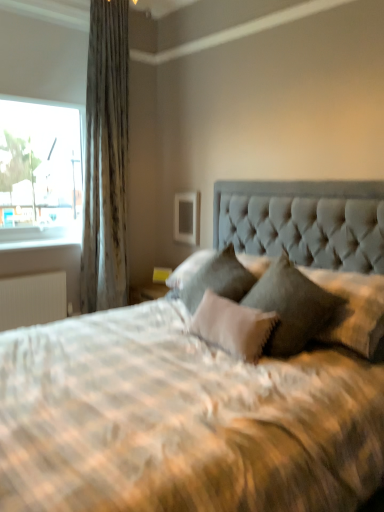
Question: Which direction should I rotate to face velvet gray pillow at center, the 3th pillow in the right-to-left sequence, — up or down?

Choices:
 (A) down
 (B) up

Answer: (A)

Question: Can you confirm if satin fabric curtain at left is bigger than velvet gray pillow at center, placed as the 1th pillow when sorted from right to left?

Choices:
 (A) yes
 (B) no

Answer: (A)

Question: From the image's perspective, is satin fabric curtain at left located above velvet gray pillow at center, which ranks as the third pillow in left-to-right order?

Choices:
 (A) no
 (B) yes

Answer: (B)

Question: Is satin fabric curtain at left wider than velvet gray pillow at center, which ranks as the third pillow in left-to-right order?

Choices:
 (A) yes
 (B) no

Answer: (B)

Question: Does satin fabric curtain at left contain velvet gray pillow at center, which ranks as the third pillow in left-to-right order?

Choices:
 (A) no
 (B) yes

Answer: (A)

Question: Could you tell me if satin fabric curtain at left is turned towards velvet gray pillow at center, placed as the 1th pillow when sorted from right to left?

Choices:
 (A) no
 (B) yes

Answer: (B)

Question: From the image's perspective, is satin fabric curtain at left below velvet gray pillow at center, placed as the 1th pillow when sorted from right to left?

Choices:
 (A) yes
 (B) no

Answer: (B)

Question: Considering the relative sizes of velvet gray pillow at center, the 1th pillow from the left, and white textured pillow at center, the second pillow positioned from the left, in the image provided, is velvet gray pillow at center, the 1th pillow from the left, smaller than white textured pillow at center, the second pillow positioned from the left,?

Choices:
 (A) yes
 (B) no

Answer: (B)

Question: Does velvet gray pillow at center, the 3th pillow in the right-to-left sequence, come in front of white textured pillow at center, which appears as the second pillow when viewed from the right?

Choices:
 (A) yes
 (B) no

Answer: (B)

Question: Is white textured pillow at center, which appears as the second pillow when viewed from the right, located within velvet gray pillow at center, the 3th pillow in the right-to-left sequence?

Choices:
 (A) yes
 (B) no

Answer: (B)

Question: From the image's perspective, does velvet gray pillow at center, the 1th pillow from the left, appear higher than white textured pillow at center, which appears as the second pillow when viewed from the right?

Choices:
 (A) no
 (B) yes

Answer: (B)

Question: Considering the relative positions of velvet gray pillow at center, the 1th pillow from the left, and white textured pillow at center, the second pillow positioned from the left, in the image provided, is velvet gray pillow at center, the 1th pillow from the left, behind white textured pillow at center, the second pillow positioned from the left,?

Choices:
 (A) yes
 (B) no

Answer: (A)

Question: Can you confirm if velvet gray pillow at center, the 3th pillow in the right-to-left sequence, is positioned to the left of white textured pillow at center, the second pillow positioned from the left?

Choices:
 (A) no
 (B) yes

Answer: (B)

Question: Is velvet gray pillow at center, the 1th pillow from the left, outside of satin fabric curtain at left?

Choices:
 (A) yes
 (B) no

Answer: (A)